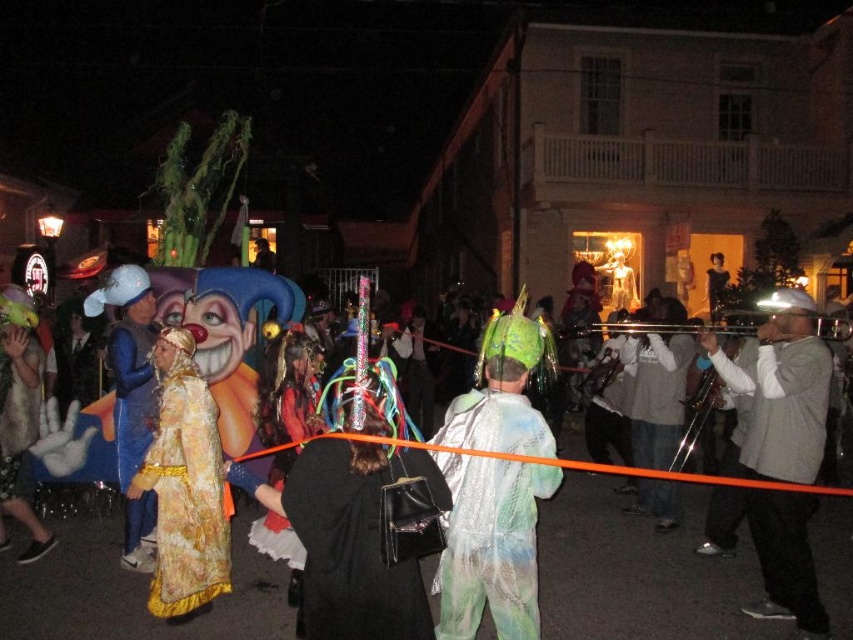
You are a photographer trying to capture a group photo of the people in the scene. You notice the white cotton shirt at center and the fuzzy gold fur coat at center. Which clothing item takes up more horizontal space in the photo?

The white cotton shirt at center takes up more horizontal space in the photo because its width is larger than that of the fuzzy gold fur coat at center.